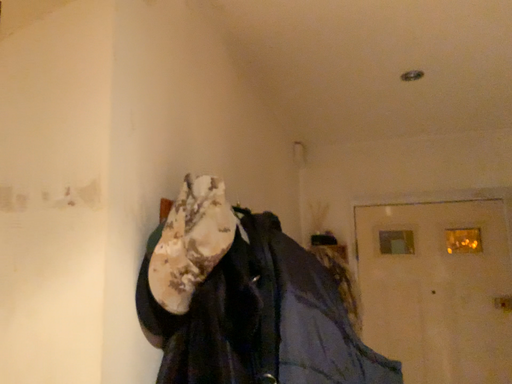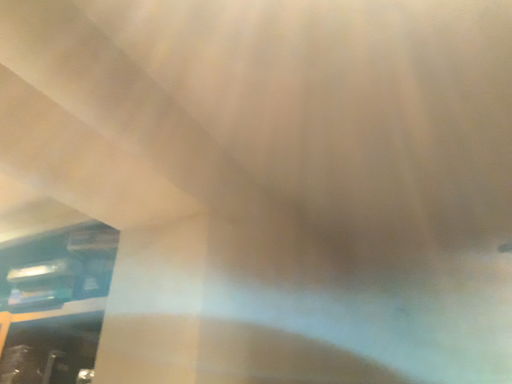
Question: How did the camera likely rotate when shooting the video?

Choices:
 (A) rotated left
 (B) rotated right

Answer: (A)